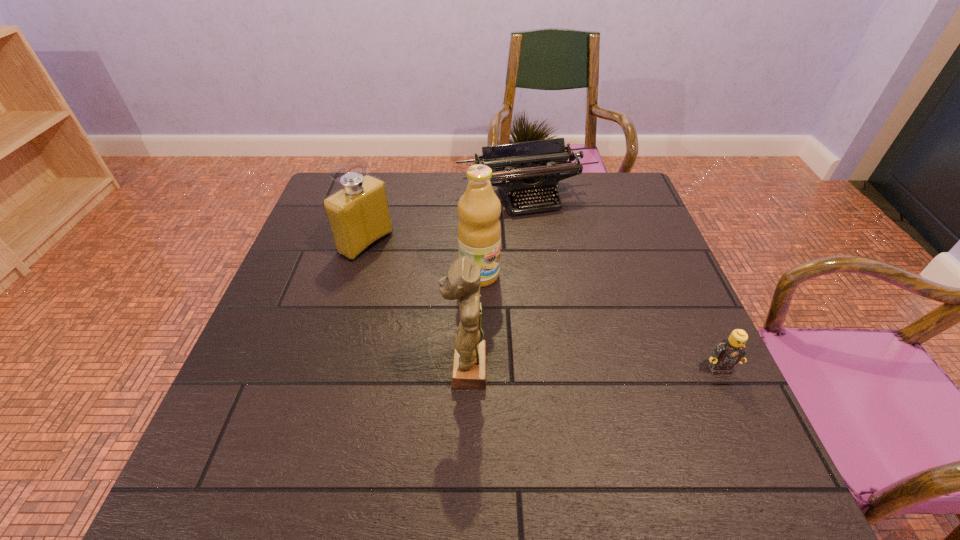
Locate an element on the screen. vacant space situated on the front-facing side of the figurine is located at coordinates (384, 368).

Locate an element on the screen. The height and width of the screenshot is (540, 960). blank area located in front of the shortest object is located at coordinates (742, 420).

Locate an element on the screen. The image size is (960, 540). vacant space positioned on the typing side of the typewriter is located at coordinates (549, 230).

This screenshot has width=960, height=540. Identify the location of vacant space located 0.360m on the typing side of the typewriter. (588, 307).

Where is `vacant space located 0.300m on the typing side of the typewriter`? Image resolution: width=960 pixels, height=540 pixels. vacant space located 0.300m on the typing side of the typewriter is located at coordinates (579, 289).

Where is `free space located on the front-facing side of the third shortest object`? free space located on the front-facing side of the third shortest object is located at coordinates (419, 272).

In order to click on vacant space situated 0.370m on the front-facing side of the third shortest object in this screenshot , I will do pos(499,316).

This screenshot has width=960, height=540. What are the coordinates of `free space located on the front-facing side of the third shortest object` in the screenshot? It's located at (489, 310).

Image resolution: width=960 pixels, height=540 pixels. I want to click on vacant space positioned on the label of the olive oil, so pyautogui.click(x=634, y=388).

The width and height of the screenshot is (960, 540). I want to click on blank space located 0.050m on the label of the olive oil, so click(508, 296).